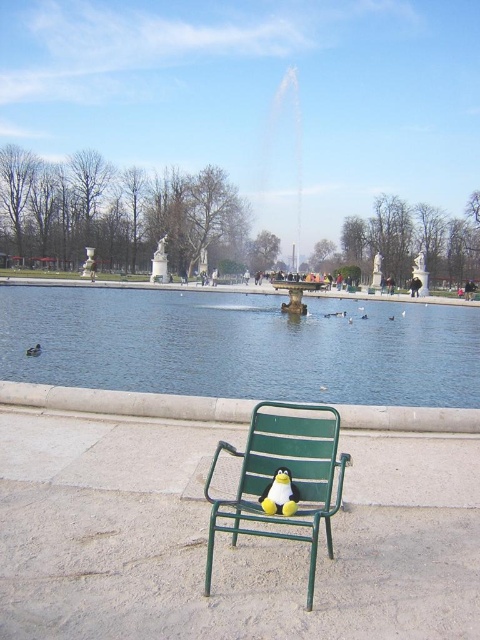
Does point (268, 497) come behind point (392, 314)?

No, it is not.

Can you confirm if yellow plush duck at center is shorter than brown feathered duck at center?

Yes.

I want to click on yellow plush duck at center, so click(x=279, y=493).

What do you see at coordinates (290, 476) in the screenshot? The width and height of the screenshot is (480, 640). I see `green metal chair at center` at bounding box center [290, 476].

At what (x,y) coordinates should I click in order to perform the action: click on green metal chair at center. Please return your answer as a coordinate pair (x, y). The image size is (480, 640). Looking at the image, I should click on (290, 476).

You are a GUI agent. You are given a task and a screenshot of the screen. Output one action in this format:
    pyautogui.click(x=<x>, y=<y>)
    Task: Click on the green metal chair at center
    This screenshot has width=480, height=640.
    Given the screenshot: What is the action you would take?
    pyautogui.click(x=290, y=476)

Is point (267, 172) less distant than point (275, 497)?

No, it is not.

Which is more to the right, metallic fountain at center or yellow plush duck at center?

metallic fountain at center

The width and height of the screenshot is (480, 640). In order to click on metallic fountain at center in this screenshot , I will do `click(290, 148)`.